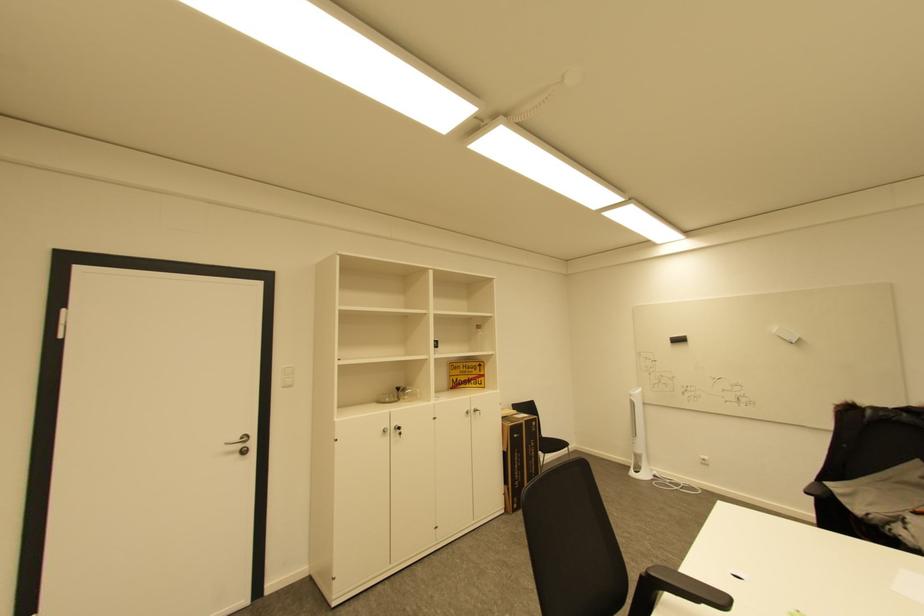
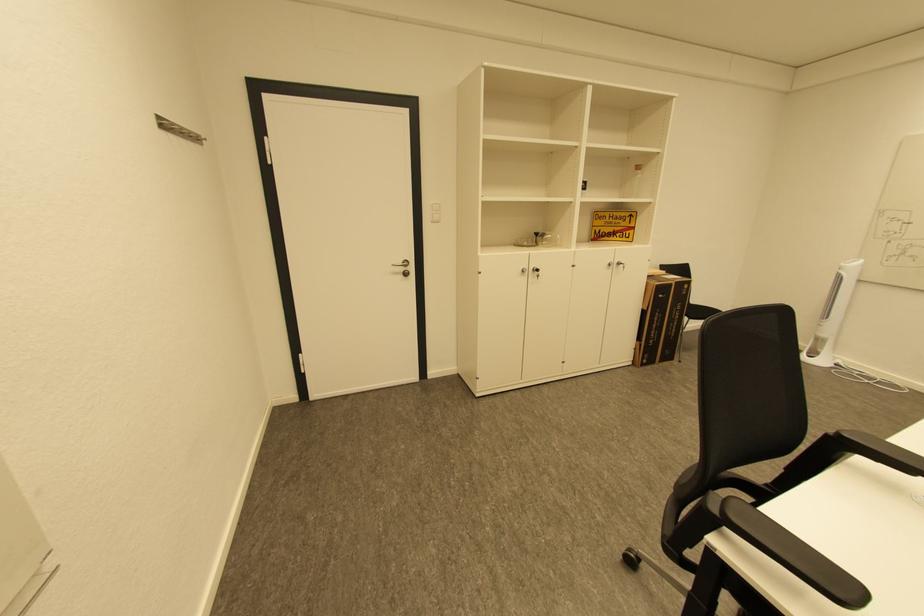
Locate, in the second image, the point that corresponds to [460,382] in the first image.

(603, 233)